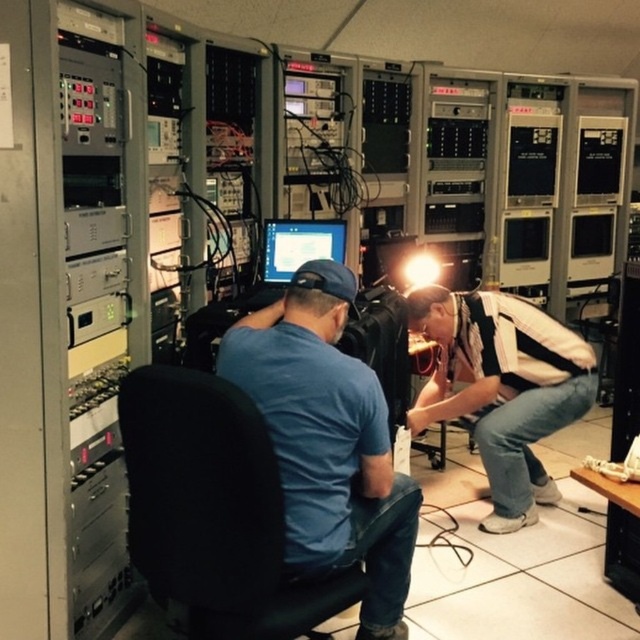
Question: Is black fabric swivel chair at center closer to camera compared to white striped shirt at lower right?

Choices:
 (A) no
 (B) yes

Answer: (B)

Question: Which of the following is the farthest from the observer?

Choices:
 (A) 291,221
 (B) 284,376
 (C) 248,636

Answer: (A)

Question: Can you confirm if blue cotton shirt at center is positioned to the left of white striped shirt at lower right?

Choices:
 (A) no
 (B) yes

Answer: (B)

Question: Which point is closer to the camera?

Choices:
 (A) (484, 346)
 (B) (346, 480)
 (C) (243, 584)
 (D) (275, 264)

Answer: (C)

Question: Which object appears closest to the camera in this image?

Choices:
 (A) white striped shirt at lower right
 (B) blue cotton shirt at center
 (C) black fabric swivel chair at center
 (D) matte black monitor at center

Answer: (C)

Question: Is white striped shirt at lower right below matte black monitor at center?

Choices:
 (A) yes
 (B) no

Answer: (A)